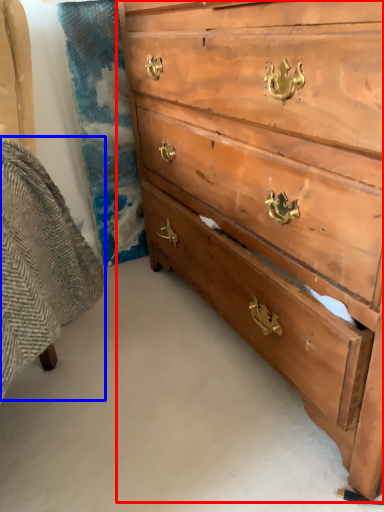
Question: Which object appears closest to the camera in this image, chest of drawers (highlighted by a red box) or swivel chair (highlighted by a blue box)?

Choices:
 (A) chest of drawers
 (B) swivel chair

Answer: (B)